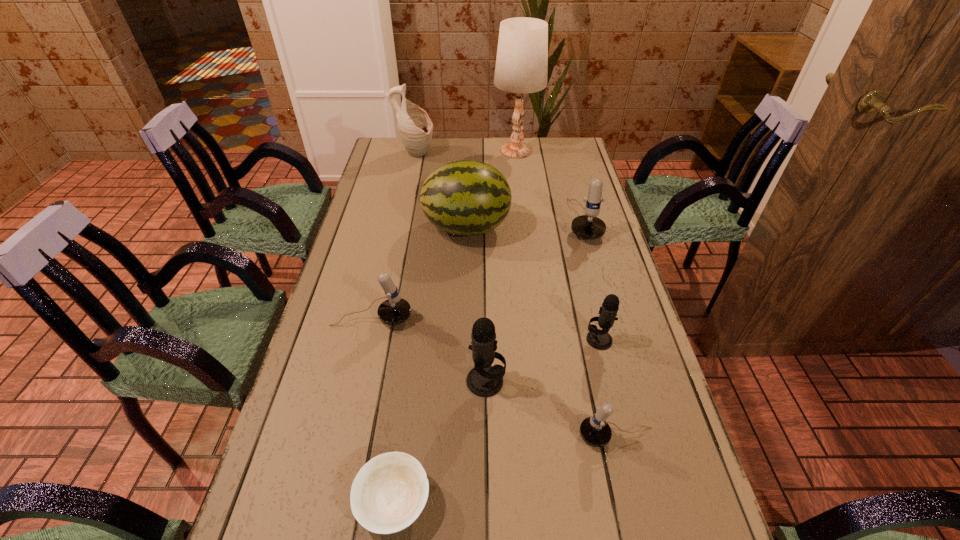
Identify the location of free region at the far right corner. (561, 163).

Find the location of a particular element. Image resolution: width=960 pixels, height=540 pixels. free space between the leftmost microphone and the farthest white microphone is located at coordinates (477, 269).

At what (x,y) coordinates should I click in order to perform the action: click on free space between the seventh farthest object and the leftmost white microphone. Please return your answer as a coordinate pair (x, y). The image size is (960, 540). Looking at the image, I should click on (x=429, y=349).

The width and height of the screenshot is (960, 540). I want to click on free space between the farthest microphone and the watermelon, so click(525, 224).

What are the coordinates of `vacant point located between the nearest white microphone and the smaller black microphone` in the screenshot? It's located at (608, 388).

Locate an element on the screen. The height and width of the screenshot is (540, 960). free space that is in between the second microphone from left to right and the second biggest white microphone is located at coordinates (429, 349).

Locate an element on the screen. This screenshot has height=540, width=960. blank region between the eighth tallest object and the nearer black microphone is located at coordinates (551, 409).

This screenshot has height=540, width=960. Identify the location of free space between the pitcher and the nearest microphone. (516, 295).

Identify the location of free point between the farthest white microphone and the green watermelon. This screenshot has height=540, width=960. (525, 224).

Select which object appears as the fourth closest to the shortest microphone. Please provide its 2D coordinates. Your answer should be formatted as a tuple, i.e. [(x, y)], where the tuple contains the x and y coordinates of a point satisfying the conditions above.

[(395, 310)]